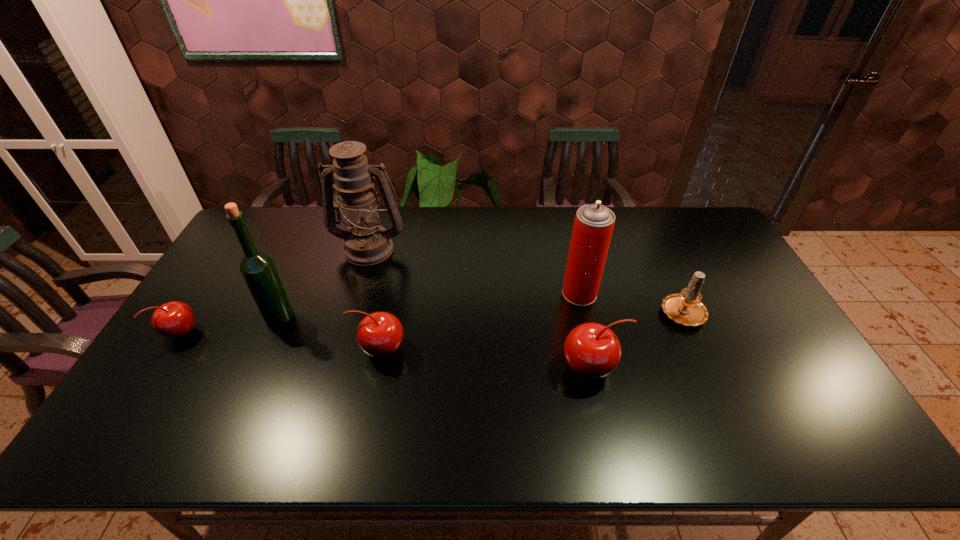
Locate an element on the screen. This screenshot has width=960, height=540. vacant region at the left edge of the desktop is located at coordinates (215, 336).

Where is `vacant space at the right edge`? vacant space at the right edge is located at coordinates (746, 305).

I want to click on vacant area that lies between the second object from left to right and the farthest object, so click(x=324, y=282).

The image size is (960, 540). I want to click on free space between the second object from left to right and the rightmost cherry, so click(436, 343).

Identify the location of empty space that is in between the shortest object and the liquor. The image size is (960, 540). (230, 325).

Where is `unoccupied area between the farthest object and the rightmost cherry`? The width and height of the screenshot is (960, 540). unoccupied area between the farthest object and the rightmost cherry is located at coordinates (481, 308).

The image size is (960, 540). What are the coordinates of `free space between the third tallest object and the second tallest cherry` in the screenshot? It's located at (479, 322).

Find the location of a particular element. This screenshot has height=540, width=960. free space between the shortest object and the rightmost object is located at coordinates (432, 322).

You are a GUI agent. You are given a task and a screenshot of the screen. Output one action in this format:
    pyautogui.click(x=<x>, y=<y>)
    Task: Click on the free space between the rightmost object and the aerosol can
    This screenshot has height=540, width=960.
    Given the screenshot: What is the action you would take?
    point(631,303)

Identify which object is located as the third nearest to the leftmost object. Please provide its 2D coordinates. Your answer should be formatted as a tuple, i.e. [(x, y)], where the tuple contains the x and y coordinates of a point satisfying the conditions above.

[(379, 334)]